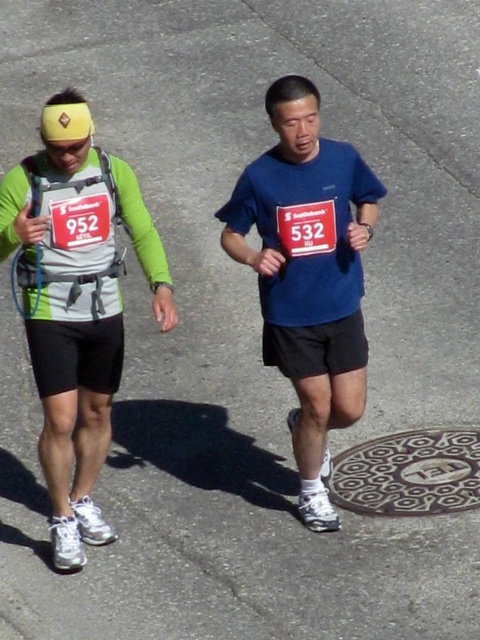
You are a drone operator assigned to capture aerial footage of the marathon runners. Your task is to ensure that both runners are visible in the frame. The camera is currently positioned above point (76, 304). Which runner should you adjust the camera to focus on to include both runners in the frame?

The point (76, 304) is where the matte green shirt at left is located. To include both runners in the frame, the camera should focus on the matte green shirt at left since it is positioned at the specified point, allowing the operator to adjust the camera angle to encompass both runners.

From the picture: You are a photographer positioned on the side of the road during a marathon. You want to take a photo of the blue matte shirt at center and the metallic textured manhole cover at lower center. Which object should you zoom in on to ensure both are clearly visible in the frame?

The blue matte shirt at center is bigger than the metallic textured manhole cover at lower center, so you should zoom in on the metallic textured manhole cover at lower center to ensure both are clearly visible in the frame.